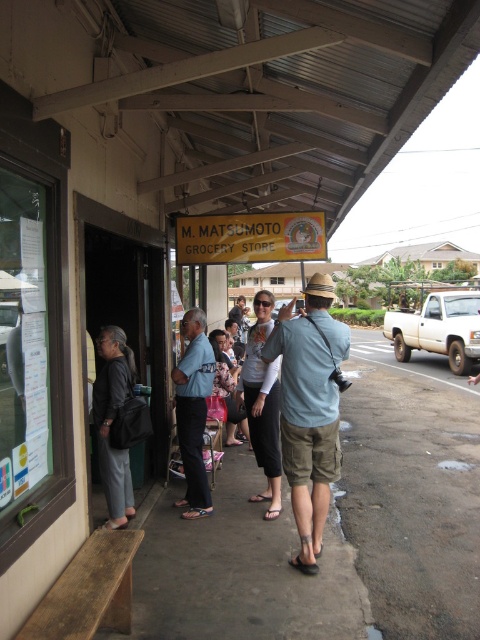
You are standing in line at M. Matsumoto Grocery Store and notice two people ahead of you. The person wearing dark gray fabric pants at left is blocking your view of the entrance. Can you see the matte black shirt at center through them?

The dark gray fabric pants at left is in front of matte black shirt at center, so the matte black shirt at center is partially or fully obscured from your view.

You are standing in front of the M. Matsumoto Grocery Store and want to take a photo of both the point at coordinates (193, 481) and the point at coordinates (240, 332). Which point should you focus on first to ensure both are in focus?

You should focus on the point at coordinates (193, 481) first because it is closer to you than the point at coordinates (240, 332), ensuring both will be in focus when using depth of field.